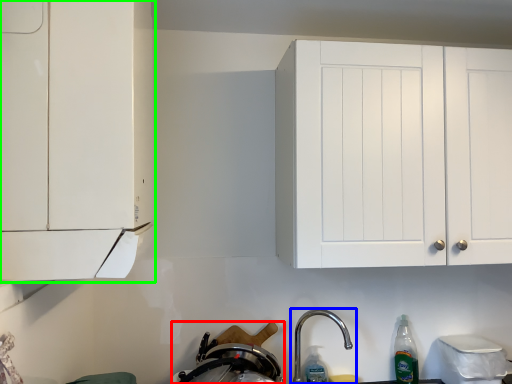
Question: Which is farther away from appliance (highlighted by a red box)? tap (highlighted by a blue box) or cabinetry (highlighted by a green box)?

Choices:
 (A) tap
 (B) cabinetry

Answer: (B)